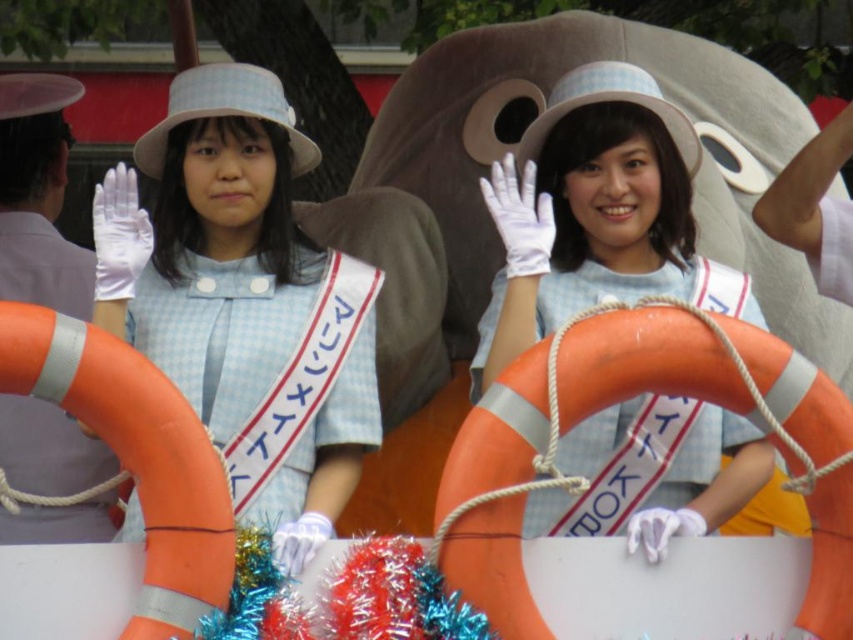
You are a photographer trying to capture both the matte blue dress at center and the matte blue sailor dress at center in the same frame. Which one should you position your camera closer to if you want to include both without zooming in?

You should position your camera closer to the matte blue dress at center since it is to the left of the matte blue sailor dress at center, allowing both to be captured in the frame without zooming.

In the scene shown: You are a photographer trying to capture the perfect shot of the matte blue dress at center. Given that the camera is focused at point 0.5,0.5, will the dress be in focus?

The matte blue dress at center is positioned at point [241,300], which is close to the camera focus point of [426,320]. Therefore, the dress will likely be in focus.